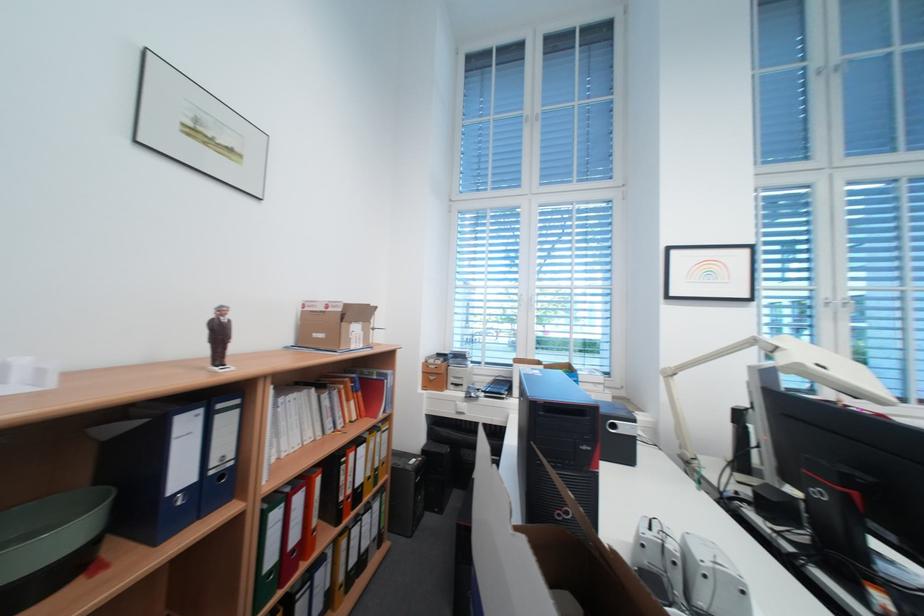
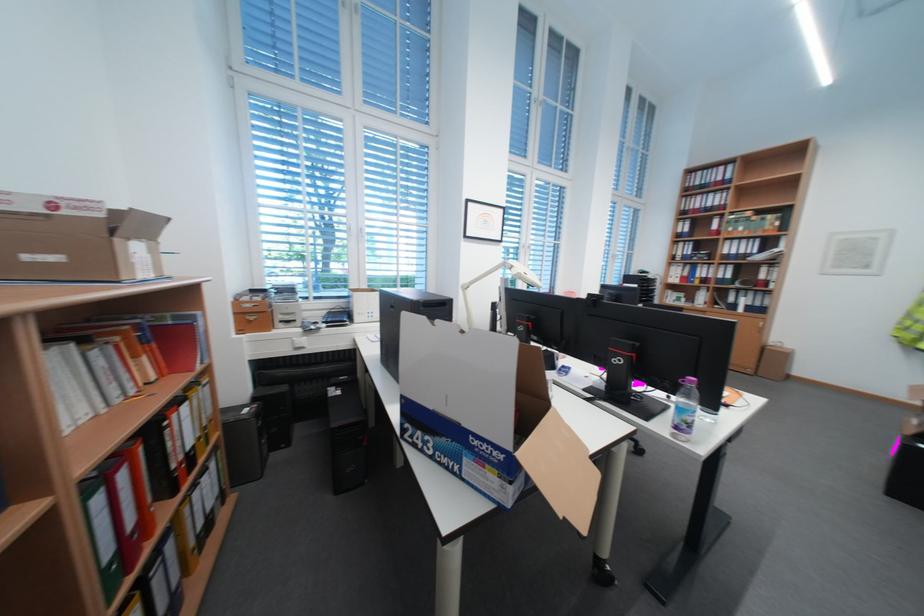
Where in the second image is the point corresponding to (x=423, y=462) from the first image?

(257, 411)